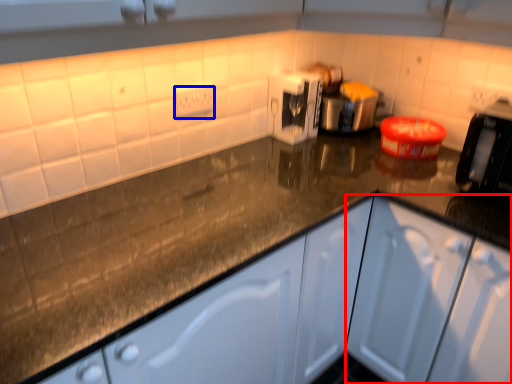
Question: Which point is further to the camera, cabinetry (highlighted by a red box) or electric outlet (highlighted by a blue box)?

Choices:
 (A) cabinetry
 (B) electric outlet

Answer: (B)